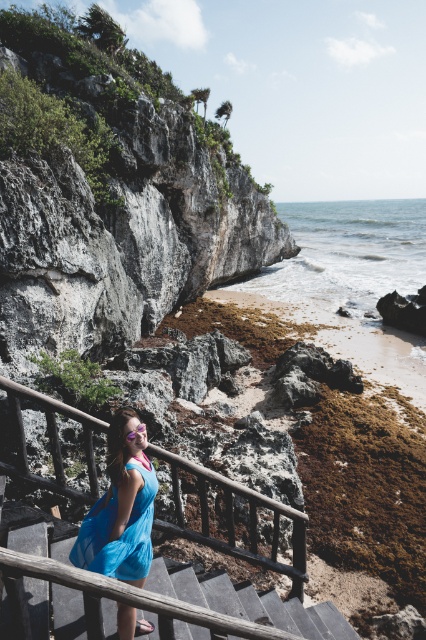
Which of these two, rugged stone cliff at center or blue fabric dress at center, stands shorter?

blue fabric dress at center is shorter.

Is rugged stone cliff at center above blue fabric dress at center?

Correct, rugged stone cliff at center is located above blue fabric dress at center.

This screenshot has height=640, width=426. Describe the element at coordinates (115, 196) in the screenshot. I see `rugged stone cliff at center` at that location.

At what (x,y) coordinates should I click in order to perform the action: click on rugged stone cliff at center. Please return your answer as a coordinate pair (x, y). This screenshot has width=426, height=640. Looking at the image, I should click on (115, 196).

Does rugged stone cliff at center appear on the right side of wooden at center?

No, rugged stone cliff at center is not to the right of wooden at center.

Can you confirm if rugged stone cliff at center is shorter than wooden at center?

No.

The width and height of the screenshot is (426, 640). What do you see at coordinates (115, 196) in the screenshot?
I see `rugged stone cliff at center` at bounding box center [115, 196].

Where is `rugged stone cliff at center`? This screenshot has height=640, width=426. rugged stone cliff at center is located at coordinates (115, 196).

Can you confirm if wooden at center is positioned below wooden stairs at center?

Correct, wooden at center is located below wooden stairs at center.

Who is more forward, (13, 424) or (178, 602)?

Point (178, 602) is more forward.

At what (x,y) coordinates should I click in order to perform the action: click on wooden at center. Please return your answer as a coordinate pair (x, y). The height and width of the screenshot is (640, 426). Looking at the image, I should click on (233, 520).